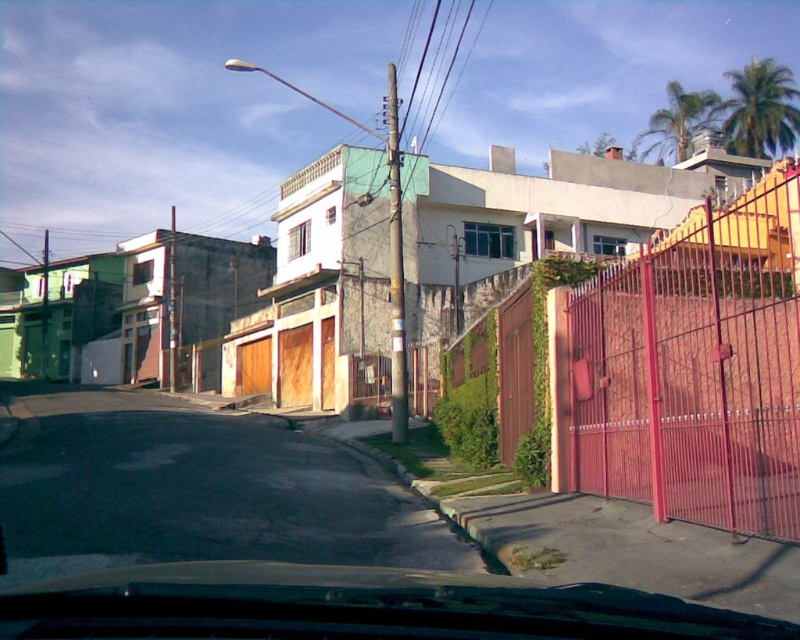
Does metallic red gate at right have a greater width compared to asphalt at lower left?

In fact, metallic red gate at right might be narrower than asphalt at lower left.

Does metallic red gate at right have a lesser height compared to asphalt at lower left?

Incorrect, metallic red gate at right's height does not fall short of asphalt at lower left's.

Describe the element at coordinates (690, 369) in the screenshot. I see `metallic red gate at right` at that location.

You are a GUI agent. You are given a task and a screenshot of the screen. Output one action in this format:
    pyautogui.click(x=<x>, y=<y>)
    Task: Click on the metallic red gate at right
    The image size is (800, 640).
    Given the screenshot: What is the action you would take?
    pyautogui.click(x=690, y=369)